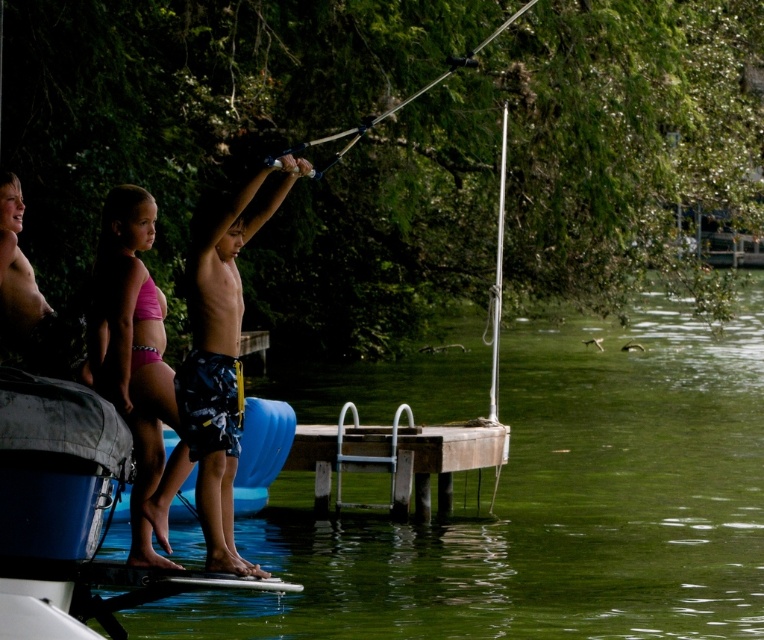
Is the position of pink fabric bikini at left more distant than that of metallic silver fishing pole at upper center?

Yes, it is behind metallic silver fishing pole at upper center.

Is pink fabric bikini at left smaller than metallic silver fishing pole at upper center?

Correct, pink fabric bikini at left occupies less space than metallic silver fishing pole at upper center.

Which is in front, point (167, 497) or point (363, 132)?

Positioned in front is point (167, 497).

The width and height of the screenshot is (764, 640). In order to click on pink fabric bikini at left in this screenshot , I will do `click(131, 349)`.

Can you confirm if pink fabric bikini at left is wider than brown wooden dock at center?

Incorrect, pink fabric bikini at left's width does not surpass brown wooden dock at center's.

Who is more distant from viewer, (125, 384) or (439, 508)?

The point (439, 508) is behind.

Identify the location of pink fabric bikini at left. Image resolution: width=764 pixels, height=640 pixels. (131, 349).

Can you confirm if dark blue swim trunks at center is taller than pink fabric bikini at left?

Yes.

Between dark blue swim trunks at center and pink fabric bikini at left, which one appears on the left side from the viewer's perspective?

Positioned to the left is pink fabric bikini at left.

Between point (202, 516) and point (157, 406), which one is positioned behind?

Positioned behind is point (157, 406).

Image resolution: width=764 pixels, height=640 pixels. In order to click on dark blue swim trunks at center in this screenshot , I will do `click(215, 364)`.